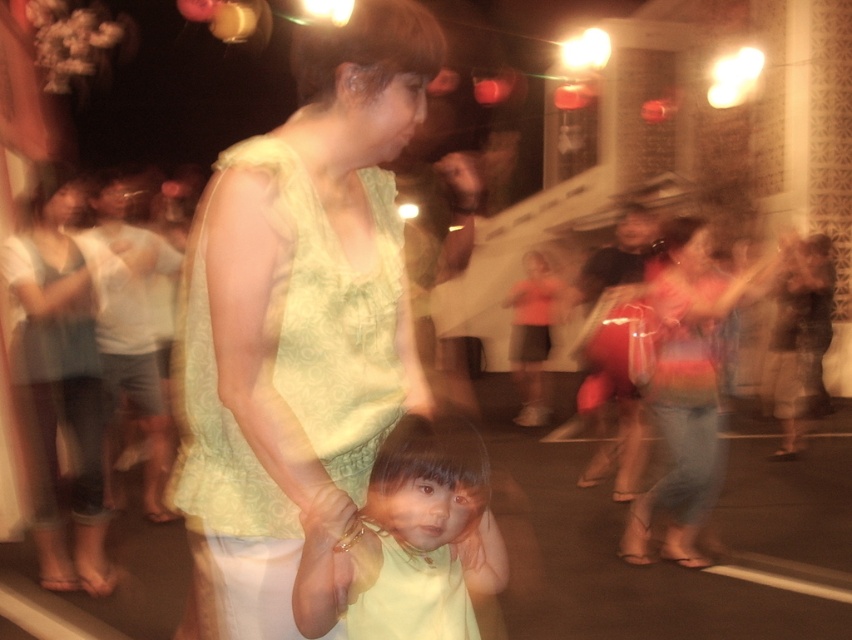
You are at the center of the scene and notice the light green fabric at center. Can you describe its exact position using coordinates?

The light green fabric at center is exactly located at coordinates point (297, 314).

You are at a party and see two fabrics displayed at the center of the room. The light green fabric at center and the light yellow fabric at center. Which fabric is taller?

The light green fabric at center is taller than the light yellow fabric at center.

Looking at this image, you are a photographer at the event and want to focus on the light green fabric at center and light yellow fabric at center. Which fabric should you adjust your camera focus to first if you want to capture both clearly?

The light green fabric at center is closer to the viewer than the light yellow fabric at center, so you should focus on the light green fabric at center first to ensure both are in focus.